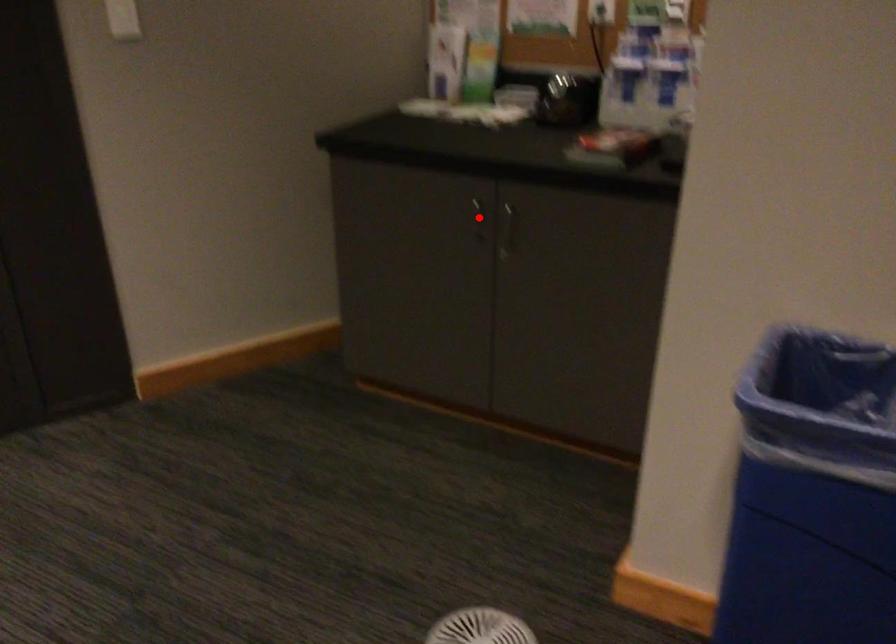
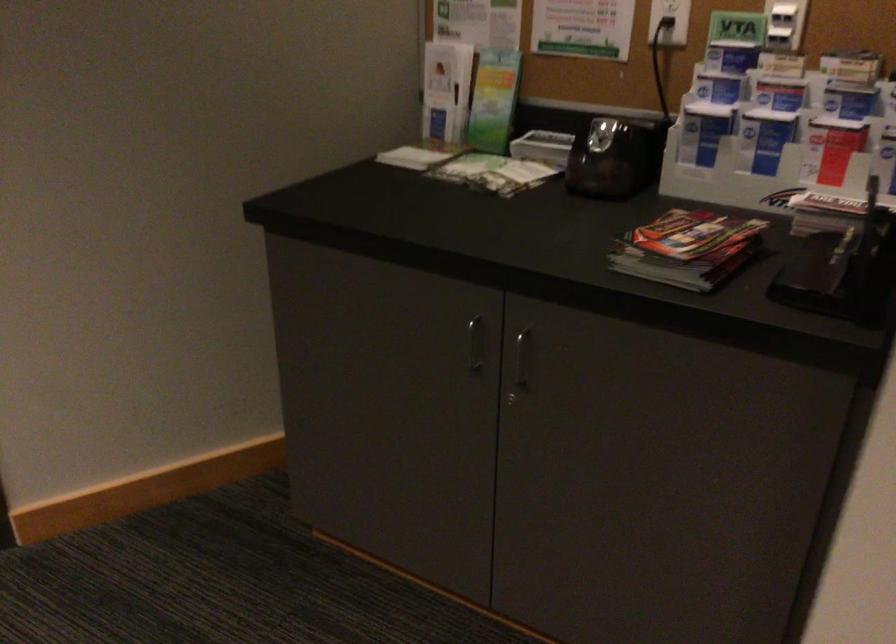
Question: I am providing you with two images of the same scene from different viewpoints. A red point is shown in image1. For the corresponding object point in image2, is it positioned nearer or farther from the camera?

Choices:
 (A) Nearer
 (B) Farther

Answer: (A)